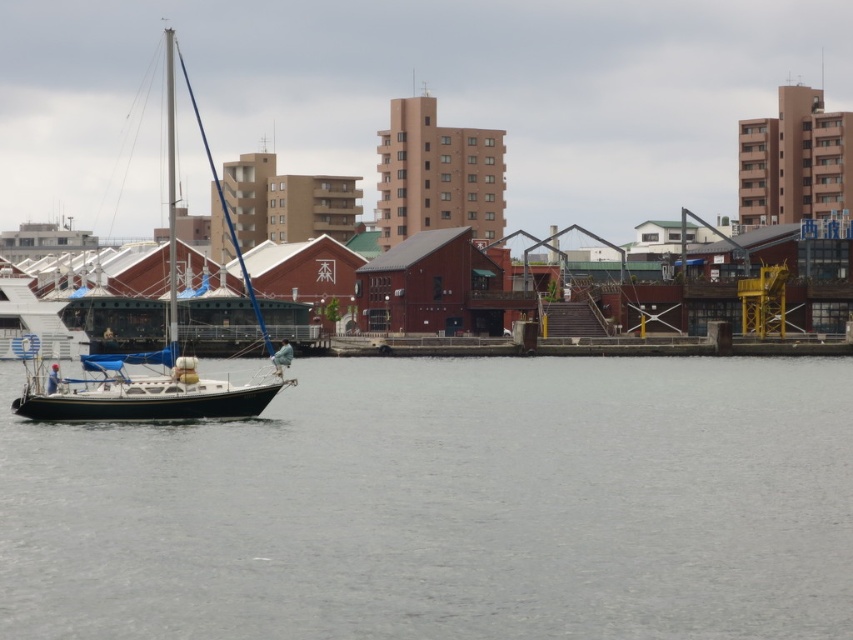
Measure the distance between clear water at lower left and white matte sailboat at center.

A distance of 24.49 meters exists between clear water at lower left and white matte sailboat at center.

Is point (193, 476) more distant than point (67, 403)?

No, it is in front of (67, 403).

Does point (440, 433) come closer to viewer compared to point (86, 362)?

That is True.

This screenshot has width=853, height=640. What are the coordinates of `clear water at lower left` in the screenshot? It's located at (447, 506).